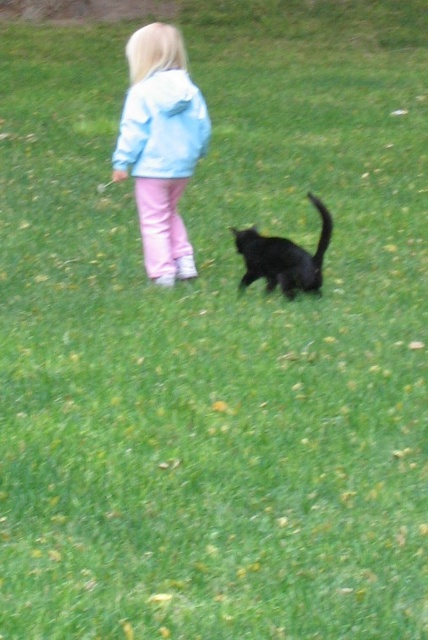
You are a photographer trying to capture the child in the scene. The light blue fleece jacket at upper center is represented by point (162,125). Where should you focus your camera to ensure the child is in focus?

You should focus your camera at point (162,125) where the light blue fleece jacket at upper center is located to ensure the child is in focus.

You are a photographer trying to capture a photo of the shiny black cat at center. You notice the light blue fleece jacket at upper left might be blocking your view. Is the jacket positioned to the left or right of the cat?

The light blue fleece jacket at upper left is to the left of the shiny black cat at center, so it is positioned to the left of the cat and may block the view.